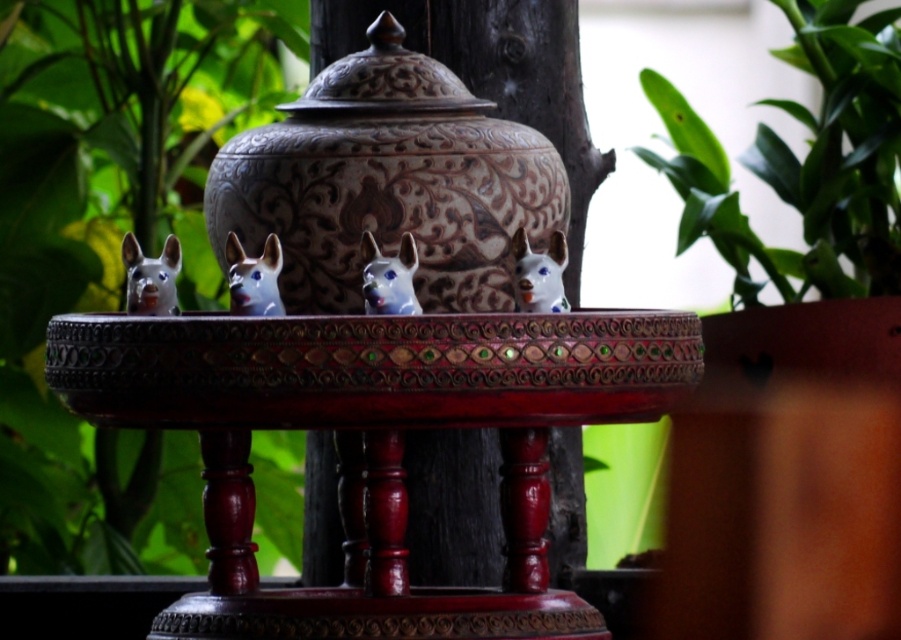
You are standing in front of the decorative arrangement. There are two points marked in the scene. The first point is at coordinate point (268, 236) and the second point is at coordinate point (533, 300). Which point is closer to you?

Point (268, 236) is in front of point (533, 300), so it is closer to you.

You are a guest at a party and want to place a small gift on the polished wood table at center without knocking over the blue glossy dog head at center. What should you be cautious about when placing the gift?

The polished wood table at center is below the blue glossy dog head at center, so you should be cautious not to bump or displace the blue glossy dog head at center when placing the gift on the table to avoid knocking it over.

You are an interior designer planning to place a new decorative item between the green leafy plant at upper right and the porcelain dog at center. Considering their sizes, which object should you use as a reference for the spacing?

The green leafy plant at upper right has a larger width than the porcelain dog at center, so you should use the green leafy plant at upper right as the reference for spacing to ensure adequate space between them.